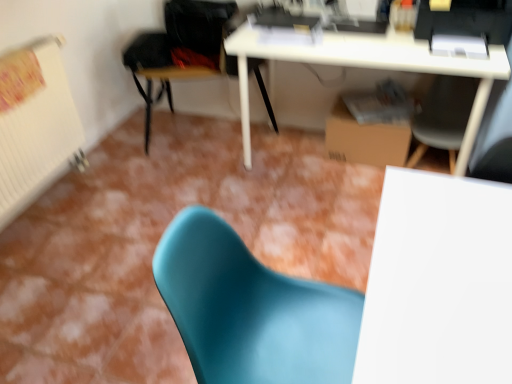
Question: From the image's perspective, is matte gray chair at center, positioned as the first chair in right-to-left order, beneath brown cardboard box at lower right?

Choices:
 (A) yes
 (B) no

Answer: (A)

Question: Does matte gray chair at center, marked as the 3th chair in a left-to-right arrangement, have a greater width compared to brown cardboard box at lower right?

Choices:
 (A) yes
 (B) no

Answer: (A)

Question: Does matte gray chair at center, marked as the 3th chair in a left-to-right arrangement, contain brown cardboard box at lower right?

Choices:
 (A) yes
 (B) no

Answer: (B)

Question: Is matte gray chair at center, positioned as the first chair in right-to-left order, oriented away from brown cardboard box at lower right?

Choices:
 (A) no
 (B) yes

Answer: (A)

Question: Does matte gray chair at center, positioned as the first chair in right-to-left order, lie behind brown cardboard box at lower right?

Choices:
 (A) no
 (B) yes

Answer: (A)

Question: Can you confirm if matte gray chair at center, which is the second chair in front-to-back order, is positioned to the right of brown cardboard box at lower right?

Choices:
 (A) yes
 (B) no

Answer: (A)

Question: Is white glossy desk at upper center at the right side of white matte table at center?

Choices:
 (A) no
 (B) yes

Answer: (A)

Question: Is the surface of white glossy desk at upper center in direct contact with white matte table at center?

Choices:
 (A) yes
 (B) no

Answer: (B)

Question: Considering the relative positions of white glossy desk at upper center and white matte table at center in the image provided, is white glossy desk at upper center in front of white matte table at center?

Choices:
 (A) no
 (B) yes

Answer: (A)

Question: Would you say white glossy desk at upper center is outside white matte table at center?

Choices:
 (A) yes
 (B) no

Answer: (A)

Question: From a real-world perspective, does white glossy desk at upper center stand above white matte table at center?

Choices:
 (A) no
 (B) yes

Answer: (A)

Question: Is white glossy desk at upper center smaller than white matte table at center?

Choices:
 (A) no
 (B) yes

Answer: (A)

Question: From a real-world perspective, is matte teal chair at lower center, the 3th chair when ordered from back to front, positioned under brown cardboard box at lower right based on gravity?

Choices:
 (A) yes
 (B) no

Answer: (B)